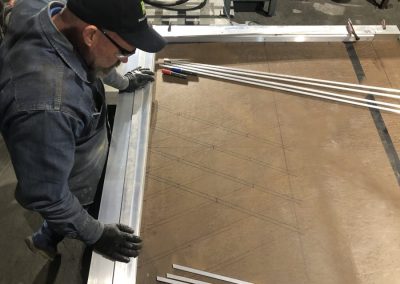
Identify the location of metal frame. The height and width of the screenshot is (284, 400). (124, 167), (249, 30).